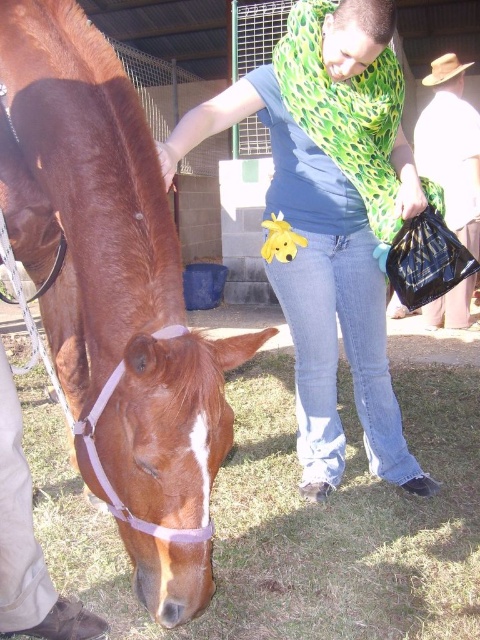
You are a photographer trying to capture the brown glossy horse at left and the brown woven hat at upper right in the same frame. Based on their sizes, which object should you focus on to ensure both fit comfortably in the photo?

The brown glossy horse at left is wider than the brown woven hat at upper right, so you should focus on the brown glossy horse at left to ensure both fit comfortably in the photo.

You are standing at the center of the image and want to move towards the brown glossy horse at left. In which direction should you move?

You should move to the left because the brown glossy horse at left is located at point (115,296), which is to the left of the center.

You are a photographer trying to capture a closeup of the brown grass at lower center while also including the green leopard print scarf at center in the frame. Can you fit both subjects into the shot without moving either the camera or the subjects?

The brown grass at lower center and green leopard print scarf at center are 34.42 inches apart from each other. Depending on the camera lens and zoom level, it might be possible to capture both in the same frame without moving anything. However, this would require a wide enough angle to encompass the 34.42 inch distance between them.